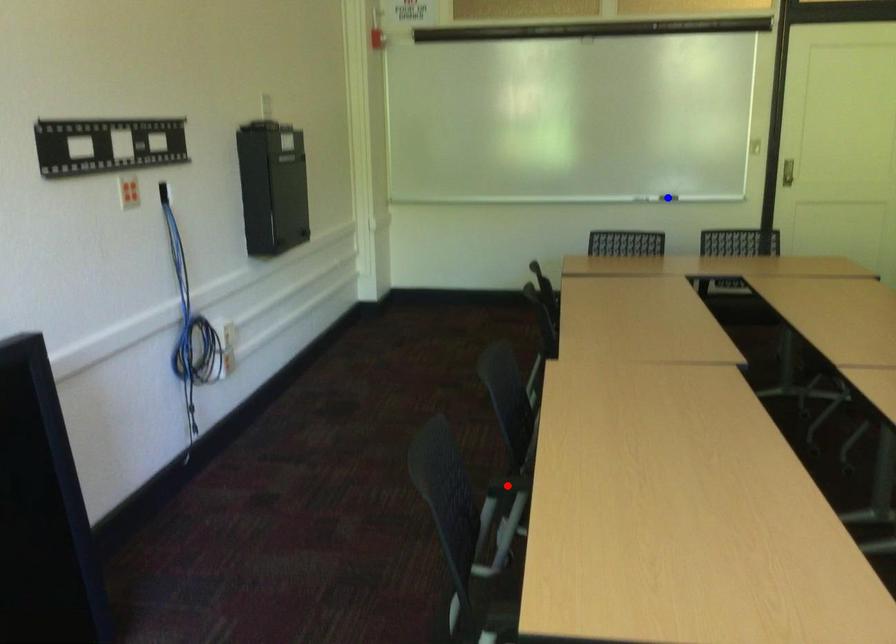
Question: In the image, two points are highlighted. Which point is nearer to the camera? Reply with the corresponding letter.

Choices:
 (A) blue point
 (B) red point

Answer: (B)